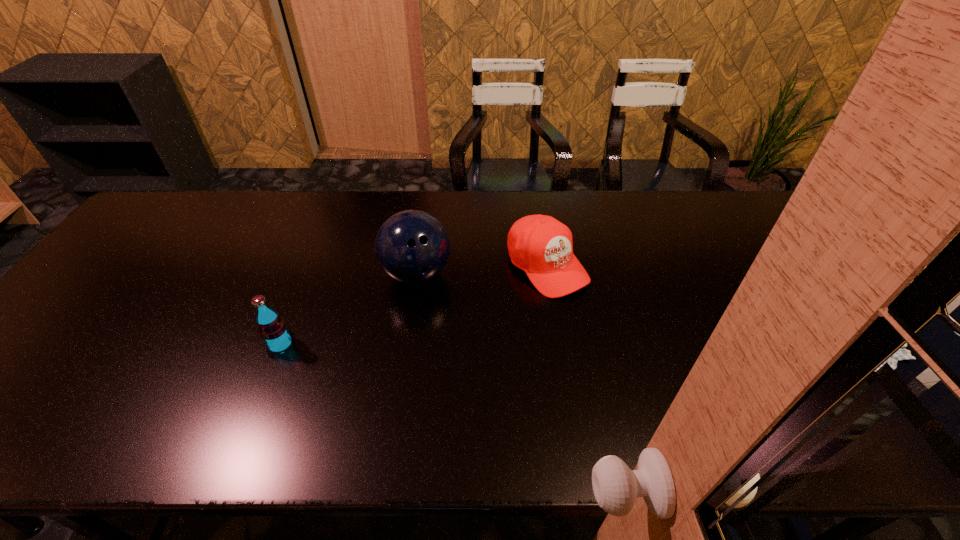
Identify the location of the nearest object. [272, 328].

I want to click on soda, so click(272, 328).

At what (x,y) coordinates should I click in order to perform the action: click on the second object from right to left. Please return your answer as a coordinate pair (x, y). Looking at the image, I should click on (412, 246).

Locate an element on the screen. Image resolution: width=960 pixels, height=540 pixels. bowling ball is located at coordinates (412, 246).

Where is `the shortest object`? Image resolution: width=960 pixels, height=540 pixels. the shortest object is located at coordinates (542, 246).

I want to click on baseball cap, so click(542, 246).

The image size is (960, 540). I want to click on blank area located on the back of the nearest object, so click(x=302, y=288).

The height and width of the screenshot is (540, 960). Find the location of `blank area located on the surface of the tallest object near the finger holes`. blank area located on the surface of the tallest object near the finger holes is located at coordinates (505, 356).

The width and height of the screenshot is (960, 540). What are the coordinates of `free location located on the surface of the tallest object near the finger holes` in the screenshot? It's located at (466, 320).

This screenshot has width=960, height=540. Find the location of `blank space located 0.160m on the surface of the tallest object near the finger holes`. blank space located 0.160m on the surface of the tallest object near the finger holes is located at coordinates pyautogui.click(x=475, y=329).